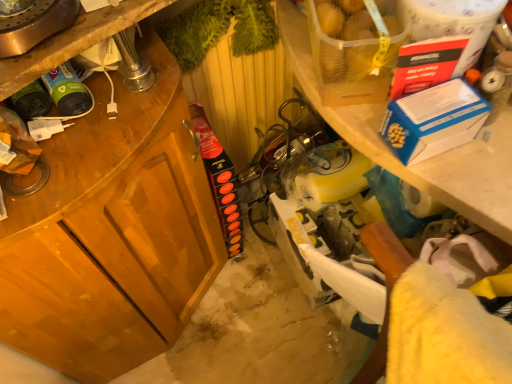
Question: From a real-world perspective, does translucent plastic bag of potatoes at upper right stand above white plastic shelf at upper right?

Choices:
 (A) yes
 (B) no

Answer: (A)

Question: Could you tell me if translucent plastic bag of potatoes at upper right is turned towards white plastic shelf at upper right?

Choices:
 (A) yes
 (B) no

Answer: (B)

Question: From the image's perspective, is translucent plastic bag of potatoes at upper right on white plastic shelf at upper right?

Choices:
 (A) yes
 (B) no

Answer: (A)

Question: From a real-world perspective, is translucent plastic bag of potatoes at upper right below white plastic shelf at upper right?

Choices:
 (A) yes
 (B) no

Answer: (B)

Question: Are translucent plastic bag of potatoes at upper right and white plastic shelf at upper right located far from each other?

Choices:
 (A) yes
 (B) no

Answer: (B)

Question: From a real-world perspective, is blue cardboard box at upper right physically located above or below white plastic shelf at upper right?

Choices:
 (A) above
 (B) below

Answer: (A)

Question: Does point (424, 104) appear closer or farther from the camera than point (387, 162)?

Choices:
 (A) closer
 (B) farther

Answer: (A)

Question: Considering their positions, is blue cardboard box at upper right located in front of or behind white plastic shelf at upper right?

Choices:
 (A) front
 (B) behind

Answer: (A)

Question: Based on their positions, is blue cardboard box at upper right located to the left or right of white plastic shelf at upper right?

Choices:
 (A) left
 (B) right

Answer: (B)

Question: From a real-world perspective, is wooden cabinet at left above or below blue cardboard box at upper right?

Choices:
 (A) below
 (B) above

Answer: (A)

Question: Visually, is wooden cabinet at left positioned to the left or to the right of blue cardboard box at upper right?

Choices:
 (A) right
 (B) left

Answer: (B)

Question: Is point (95, 248) closer or farther from the camera than point (438, 124)?

Choices:
 (A) closer
 (B) farther

Answer: (B)

Question: Looking at their shapes, would you say wooden cabinet at left is wider or thinner than blue cardboard box at upper right?

Choices:
 (A) wide
 (B) thin

Answer: (A)

Question: From a real-world perspective, is wooden cabinet at left above or below translucent plastic bag of potatoes at upper right?

Choices:
 (A) below
 (B) above

Answer: (A)

Question: In the image, is wooden cabinet at left on the left side or the right side of translucent plastic bag of potatoes at upper right?

Choices:
 (A) right
 (B) left

Answer: (B)